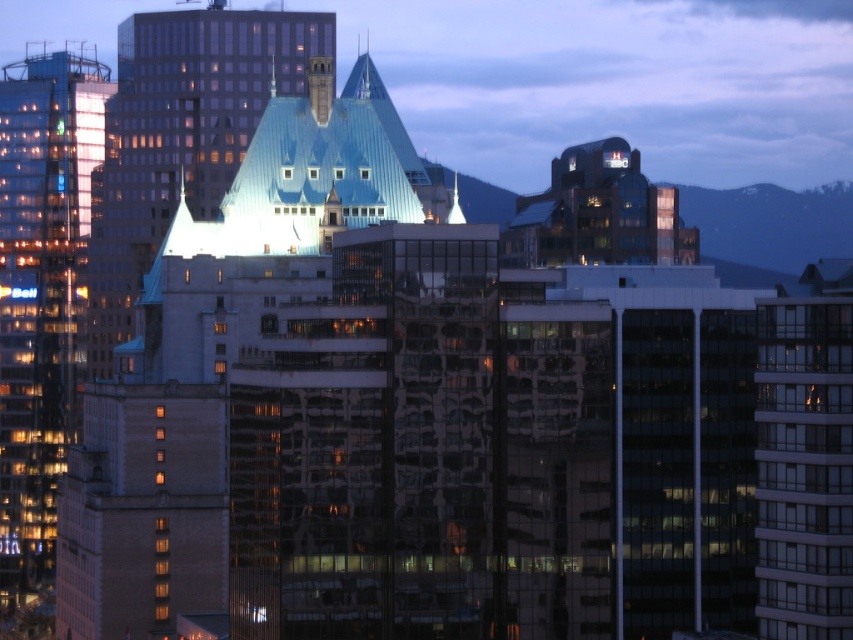
You are standing at the point with coordinates point (177, 24) and want to walk towards the point with coordinates point (10, 368). Will the building with the greenish blue roof block your path?

Point (10, 368) is behind point (177, 24), so the building with the greenish blue roof will block your path to point (10, 368).

You are standing at point (42, 294) in the city. Can you see the greenish blue roofed building in the foreground? Please explain why or why not based on your location.

The point (42, 294) is where the glassy reflective skyscraper at left is located. Since this skyscraper has reflective surfaces, it may obstruct your view of the greenish blue roofed building in the foreground depending on the angle and position of both structures.

You are an architect analyzing the city layout. From your vantage point, which building would appear closer to you, the glassy reflective skyscraper at left or the blue glass building at center?

The glassy reflective skyscraper at left is positioned under the blue glass building at center, meaning it is closer to you since objects lower in the visual field are typically nearer.